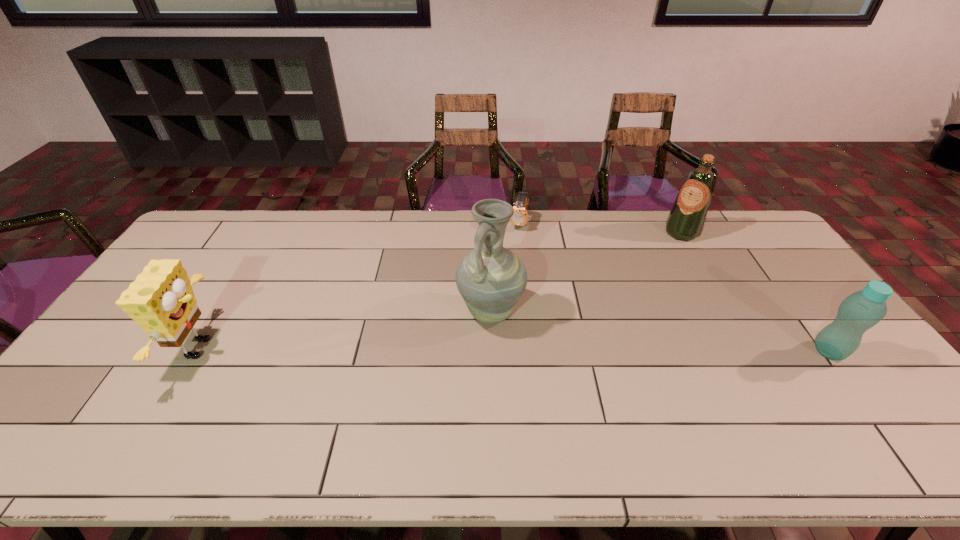
You are a GUI agent. You are given a task and a screenshot of the screen. Output one action in this format:
    pyautogui.click(x=<x>, y=<y>)
    Task: Click on the free region at the far edge of the desktop
    The height and width of the screenshot is (540, 960).
    Given the screenshot: What is the action you would take?
    pyautogui.click(x=390, y=237)

Locate an element on the screen. The height and width of the screenshot is (540, 960). blank space at the near edge of the desktop is located at coordinates (142, 409).

Identify the location of free region at the right edge. The image size is (960, 540). (817, 371).

Identify the location of free region at the far left corner of the desktop. point(227,248).

Where is `free location at the far right corner`? The width and height of the screenshot is (960, 540). free location at the far right corner is located at coordinates click(x=733, y=230).

Where is `vacant space at the near right corner of the desktop`? The width and height of the screenshot is (960, 540). vacant space at the near right corner of the desktop is located at coordinates (839, 406).

Identify the location of vacant area that lies between the leftmost object and the water bottle. (516, 350).

Locate an element on the screen. This screenshot has width=960, height=540. free space between the water bottle and the shortest object is located at coordinates (674, 287).

Find the location of a particular element. free space that is in between the second object from right to left and the water bottle is located at coordinates (756, 292).

You are a GUI agent. You are given a task and a screenshot of the screen. Output one action in this format:
    pyautogui.click(x=<x>, y=<y>)
    Task: Click on the empty space that is in between the pitcher and the fourth object from left to right
    This screenshot has height=540, width=960.
    Given the screenshot: What is the action you would take?
    pyautogui.click(x=586, y=272)